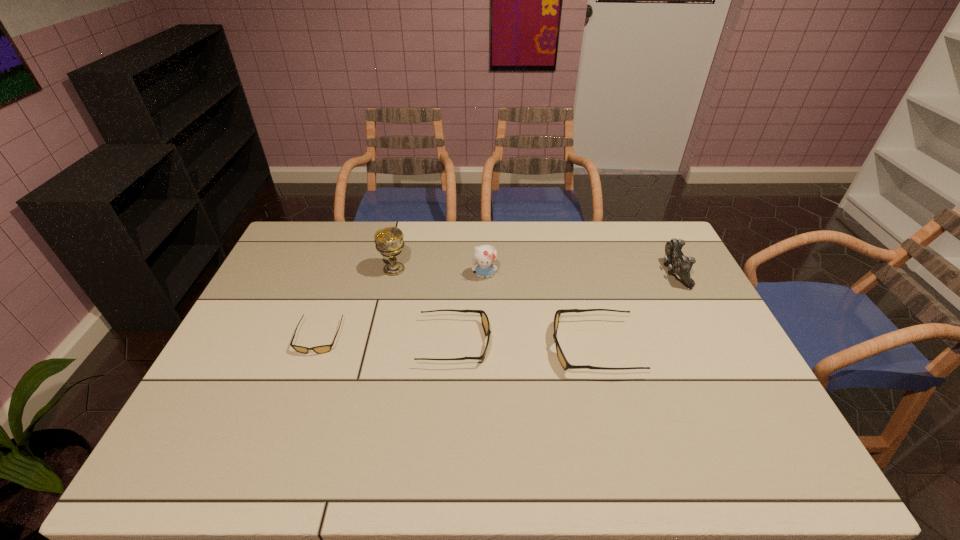
The height and width of the screenshot is (540, 960). Find the location of `the shortest object`. the shortest object is located at coordinates (324, 348).

What are the coordinates of `the leftmost sunglasses` in the screenshot? It's located at (324, 348).

The image size is (960, 540). Identify the location of the second sunglasses from left to right. (484, 318).

Identify the location of the second shortest sunglasses. (484, 318).

You are a GUI agent. You are given a task and a screenshot of the screen. Output one action in this format:
    pyautogui.click(x=<x>, y=<y>)
    Task: Click on the rightmost sunglasses
    The height and width of the screenshot is (540, 960).
    Given the screenshot: What is the action you would take?
    pyautogui.click(x=565, y=364)

Where is `control`? This screenshot has height=540, width=960. control is located at coordinates (678, 263).

The height and width of the screenshot is (540, 960). What are the coordinates of `the rightmost object` in the screenshot? It's located at click(x=678, y=263).

Where is `kitten`? kitten is located at coordinates (484, 255).

Image resolution: width=960 pixels, height=540 pixels. In order to click on chalice in this screenshot , I will do `click(389, 241)`.

I want to click on free space located on the front-facing side of the leftmost sunglasses, so click(300, 389).